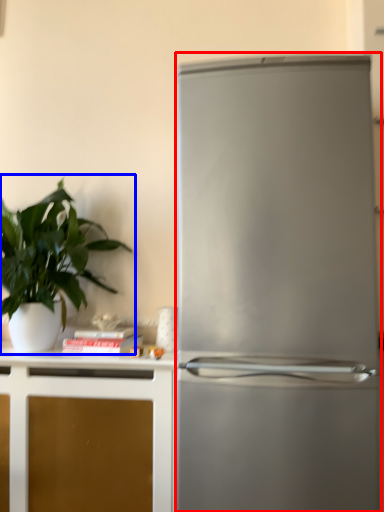
Question: Among these objects, which one is farthest to the camera, refrigerator (highlighted by a red box) or houseplant (highlighted by a blue box)?

Choices:
 (A) refrigerator
 (B) houseplant

Answer: (B)